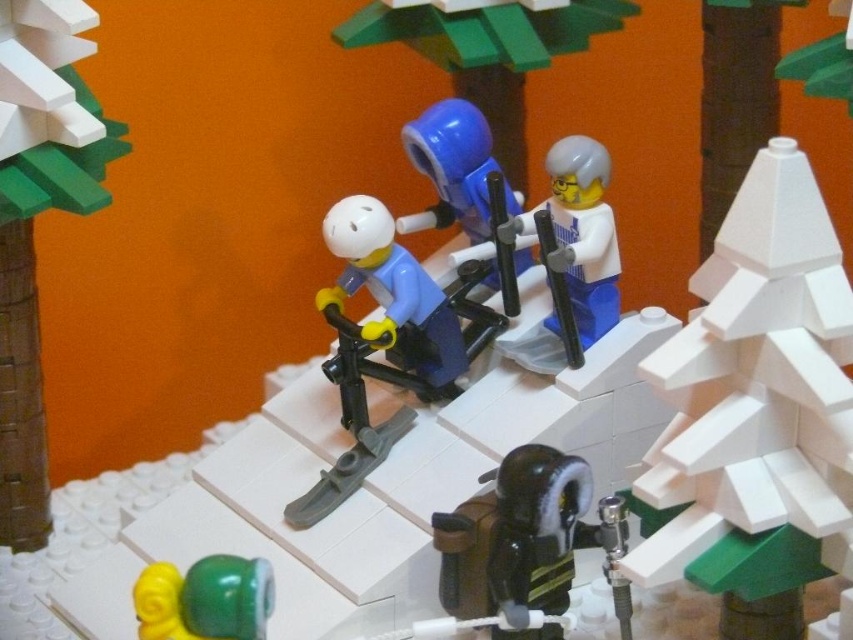
Looking at this image, can you confirm if black plastic backpack at center is taller than shiny plastic beads at lower left?

Yes.

Is black plastic backpack at center in front of shiny plastic beads at lower left?

No.

Who is more forward, (538,496) or (231,568)?

Point (231,568)

Where is `black plastic backpack at center`? The width and height of the screenshot is (853, 640). black plastic backpack at center is located at coordinates (515, 536).

Consider the image. Who is positioned more to the left, blue rubber helmet at center or blue plastic skis at center?

Positioned to the left is blue plastic skis at center.

Is point (524, 76) farther from viewer compared to point (434, 188)?

Yes, point (524, 76) is behind point (434, 188).

Describe the element at coordinates (489, 52) in the screenshot. This screenshot has width=853, height=640. I see `blue rubber helmet at center` at that location.

In order to click on blue rubber helmet at center in this screenshot , I will do `click(489, 52)`.

Is white matte figure at center above blue plastic skis at center?

Incorrect, white matte figure at center is not positioned above blue plastic skis at center.

Between white matte figure at center and blue plastic skis at center, which one has less height?

Standing shorter between the two is blue plastic skis at center.

Between point (573, 157) and point (515, 273), which one is positioned behind?

The point (515, 273) is more distant.

This screenshot has width=853, height=640. I want to click on white matte figure at center, so click(x=569, y=259).